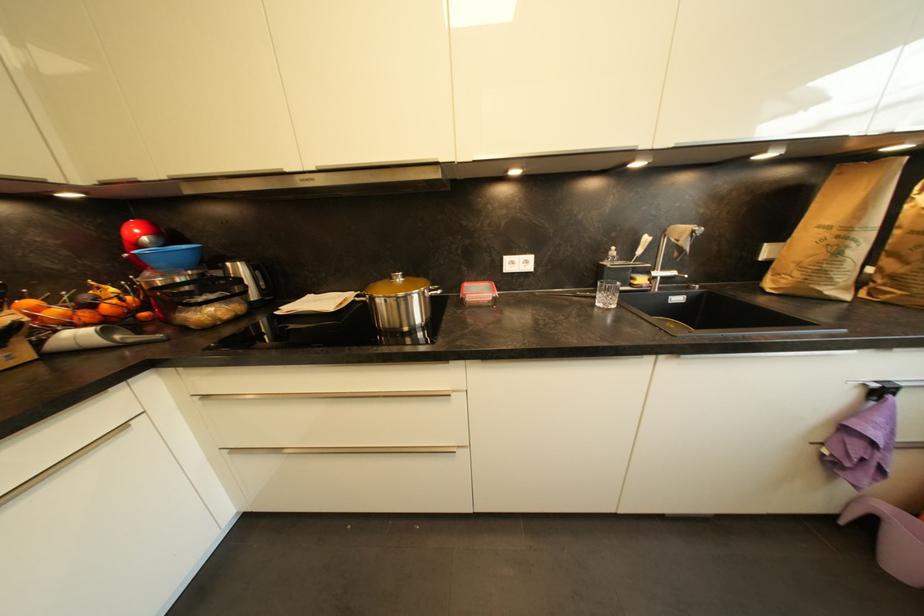
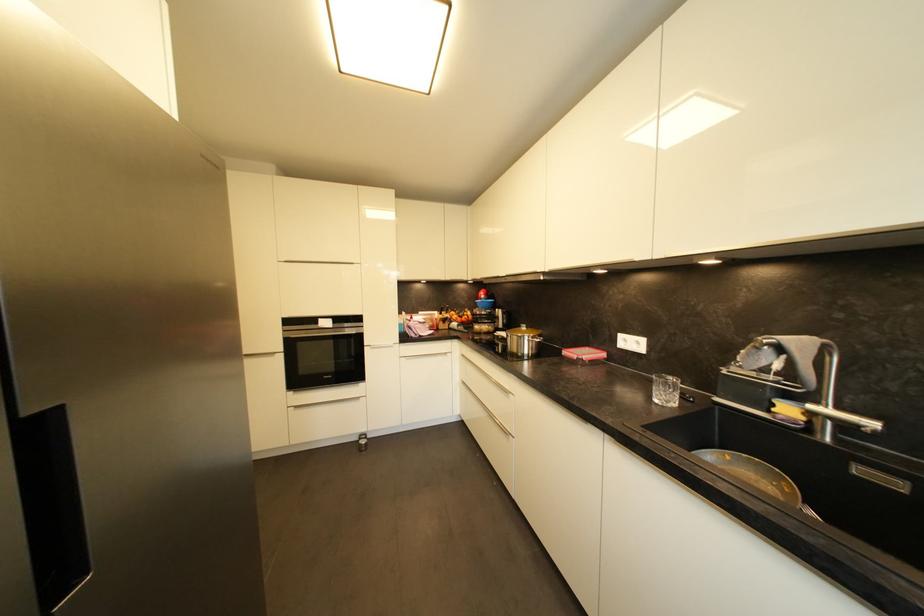
Where in the second image is the point corresponding to (x=647, y=282) from the first image?

(793, 411)